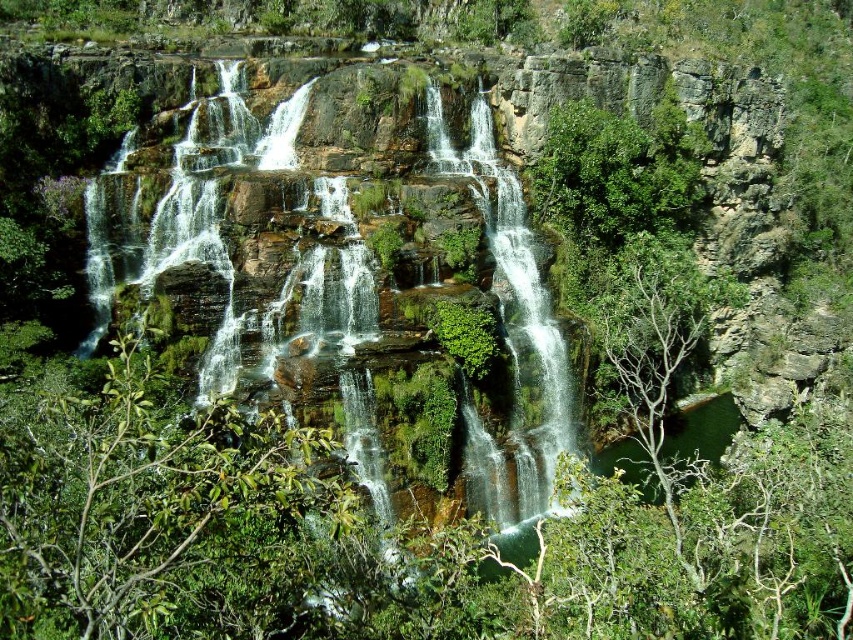
You are a hiker who wants to cross the waterfall area. You see the white frothy water at center and the green mossy rock at center. Which one is above the other?

The white frothy water at center is positioned over the green mossy rock at center, so the white frothy water is above the green mossy rock.

You are a hiker who wants to take a photo of the green leafy tree at center and the green mossy rock at center. Which object should you stand closer to in order to capture both in a single frame without zooming?

Since the green leafy tree at center is shorter than the green mossy rock at center, you should stand closer to the green leafy tree at center to include both in the frame without zooming.